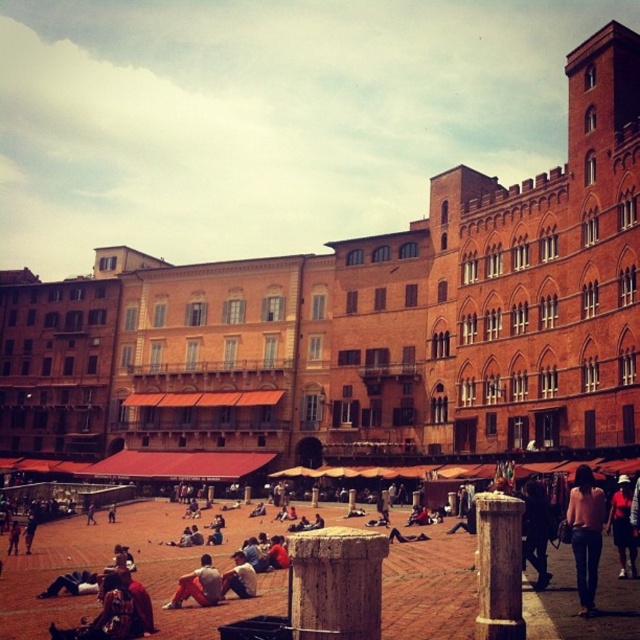
Question: Can you confirm if denim jeans at lower right is bigger than black leather jacket at lower right?

Choices:
 (A) yes
 (B) no

Answer: (A)

Question: Considering the real-world distances, which object is farthest from the black leather jacket at lower right?

Choices:
 (A) denim jeans at lower right
 (B) light brown leather jacket at center
 (C) matte red shirt at center
 (D) orange cotton pants at lower left

Answer: (D)

Question: Which point is closer to the camera taking this photo?

Choices:
 (A) (195, 589)
 (B) (534, 582)
 (C) (592, 513)
 (D) (225, 586)

Answer: (C)

Question: Does black leather jacket at lower right come behind orange cotton pants at lower left?

Choices:
 (A) yes
 (B) no

Answer: (B)

Question: Observing the image, what is the correct spatial positioning of black leather jacket at lower right in reference to matte red shirt at center?

Choices:
 (A) left
 (B) right

Answer: (A)

Question: Which object appears farthest from the camera in this image?

Choices:
 (A) black leather jacket at lower right
 (B) light brown leather jacket at center
 (C) matte red shirt at center

Answer: (B)